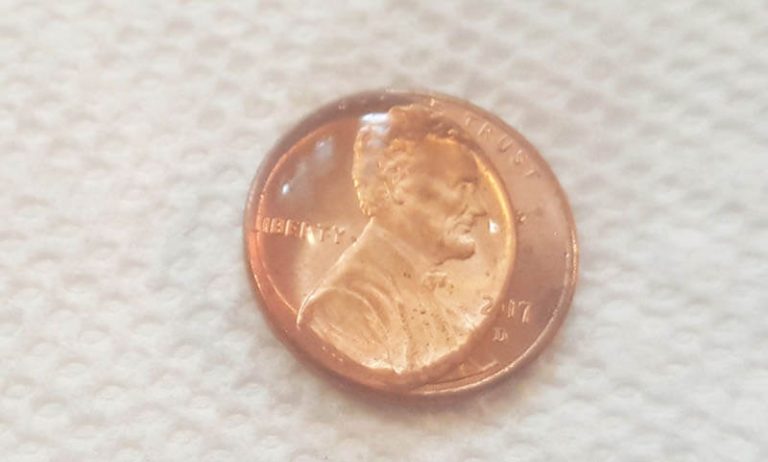
Where is `paper towel`? The height and width of the screenshot is (462, 768). paper towel is located at coordinates (151, 163).